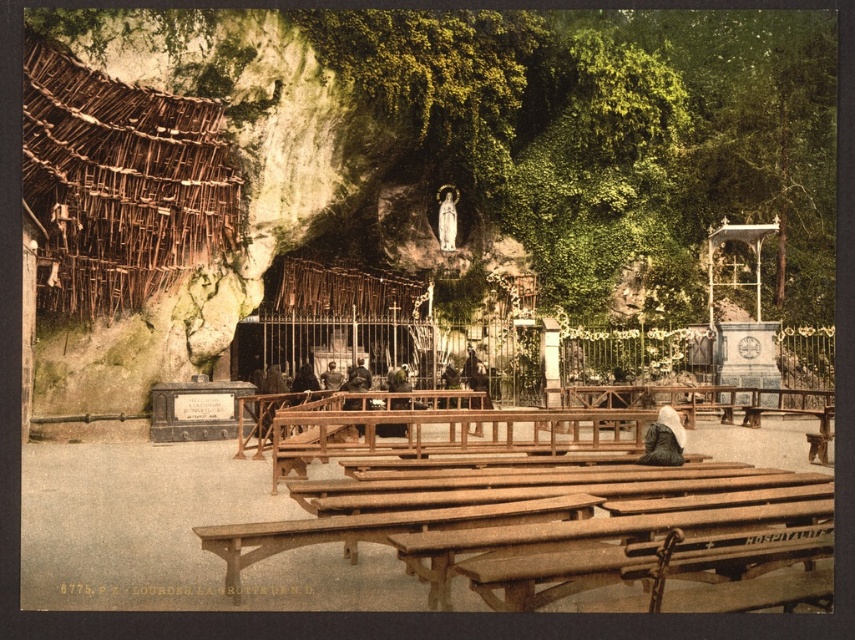
Is point (653, 456) positioned behind point (331, 371)?

No, it is not.

Can you confirm if dark gray woolen robe at center is positioned below dark brown leather jacket at center?

Yes, dark gray woolen robe at center is below dark brown leather jacket at center.

What do you see at coordinates (663, 440) in the screenshot? I see `dark gray woolen robe at center` at bounding box center [663, 440].

Image resolution: width=855 pixels, height=640 pixels. Identify the location of dark gray woolen robe at center. (663, 440).

Can you confirm if wooden park bench at lower center is thinner than dark gray woolen robe at center?

Incorrect, wooden park bench at lower center's width is not less than dark gray woolen robe at center's.

Which is behind, point (431, 545) or point (652, 460)?

Positioned behind is point (652, 460).

The image size is (855, 640). Identify the location of wooden park bench at lower center. point(576,536).

Who is higher up, wooden picnic table at center or dark gray woolen robe at center?

dark gray woolen robe at center

Who is more distant from viewer, (733, 481) or (671, 436)?

The point (671, 436) is more distant.

This screenshot has height=640, width=855. What are the coordinates of `wooden picnic table at center` in the screenshot? It's located at (520, 513).